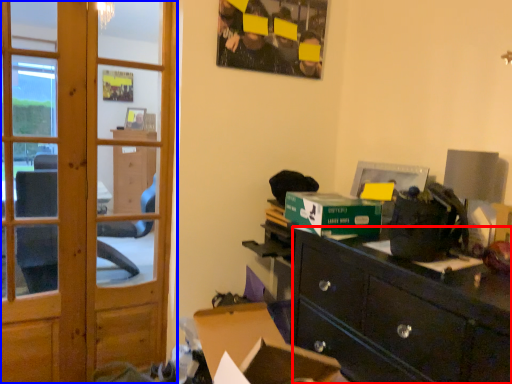
Question: Which object appears farthest to the camera in this image, desk (highlighted by a red box) or door (highlighted by a blue box)?

Choices:
 (A) desk
 (B) door

Answer: (B)